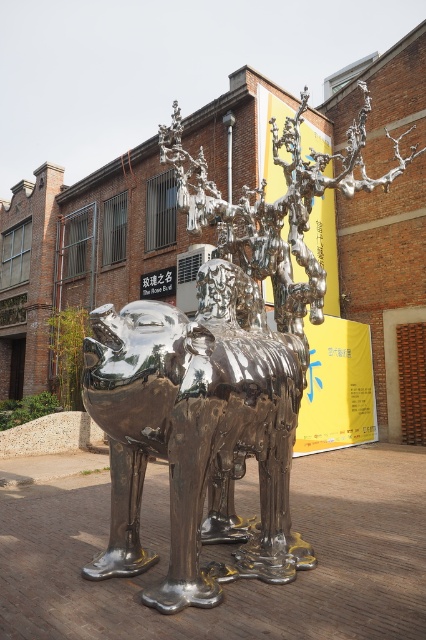
Question: Considering the real-world distances, which object is farthest from the shiny metallic camel at center?

Choices:
 (A) green leafy plant at left
 (B) shiny metallic deer at center

Answer: (A)

Question: Can you confirm if shiny metallic camel at center is positioned to the right of green leafy plant at left?

Choices:
 (A) no
 (B) yes

Answer: (B)

Question: Is shiny metallic deer at center above shiny metallic camel at center?

Choices:
 (A) no
 (B) yes

Answer: (B)

Question: Which is farther from the green leafy plant at left?

Choices:
 (A) shiny metallic deer at center
 (B) shiny metallic camel at center

Answer: (B)

Question: Can you confirm if shiny metallic deer at center is positioned above shiny metallic camel at center?

Choices:
 (A) no
 (B) yes

Answer: (B)

Question: Which object is positioned farthest from the shiny metallic deer at center?

Choices:
 (A) green leafy plant at left
 (B) shiny metallic camel at center

Answer: (A)